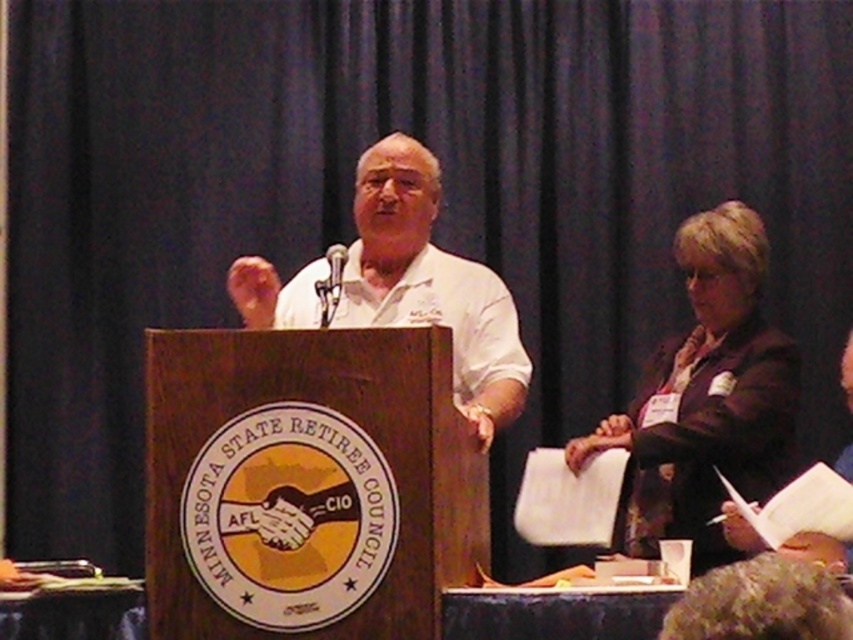
Question: Which point appears closest to the camera in this image?

Choices:
 (A) (688, 444)
 (B) (463, 336)

Answer: (B)

Question: Does dark brown suit at right have a greater width compared to white matte shirt at center?

Choices:
 (A) yes
 (B) no

Answer: (B)

Question: Is dark brown suit at right positioned at the back of white matte shirt at center?

Choices:
 (A) yes
 (B) no

Answer: (A)

Question: Which object is farther from the camera taking this photo?

Choices:
 (A) white matte shirt at center
 (B) dark brown suit at right

Answer: (B)

Question: Is dark brown suit at right bigger than white matte shirt at center?

Choices:
 (A) no
 (B) yes

Answer: (A)